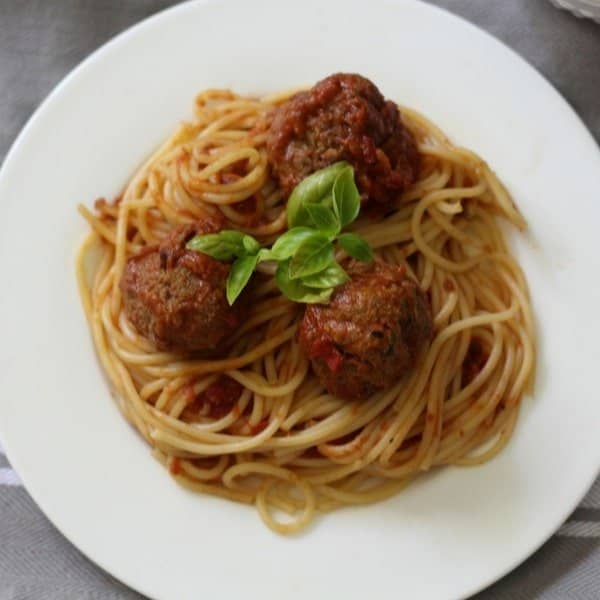
In order to click on round ceramic plate in this screenshot , I will do `click(284, 42)`.